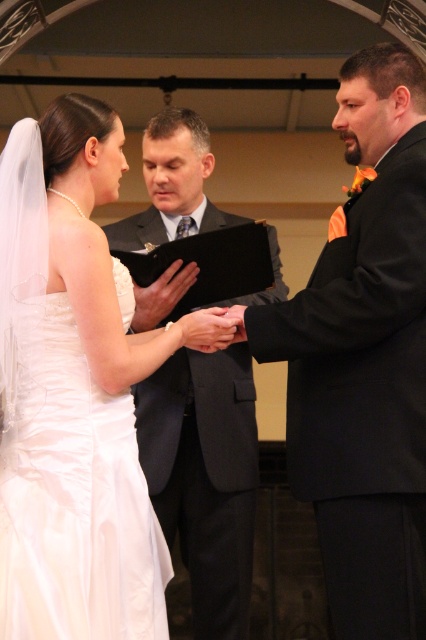
Question: Which object appears closest to the camera in this image?

Choices:
 (A) black satin suit at right
 (B) matte black suit at center

Answer: (A)

Question: Can you confirm if matte black suit at center is bigger than matte black hand at center?

Choices:
 (A) no
 (B) yes

Answer: (B)

Question: Does black satin suit at right have a larger size compared to matte black suit at center?

Choices:
 (A) no
 (B) yes

Answer: (A)

Question: Which is farther from the matte black hand at center?

Choices:
 (A) black satin suit at right
 (B) white satin dress at left
 (C) matte black suit at center

Answer: (C)

Question: Is black satin suit at right closer to camera compared to matte black hand at center?

Choices:
 (A) no
 (B) yes

Answer: (B)

Question: Which object appears closest to the camera in this image?

Choices:
 (A) black satin suit at right
 (B) matte black hand at center
 (C) matte black suit at center
 (D) white satin dress at left

Answer: (D)